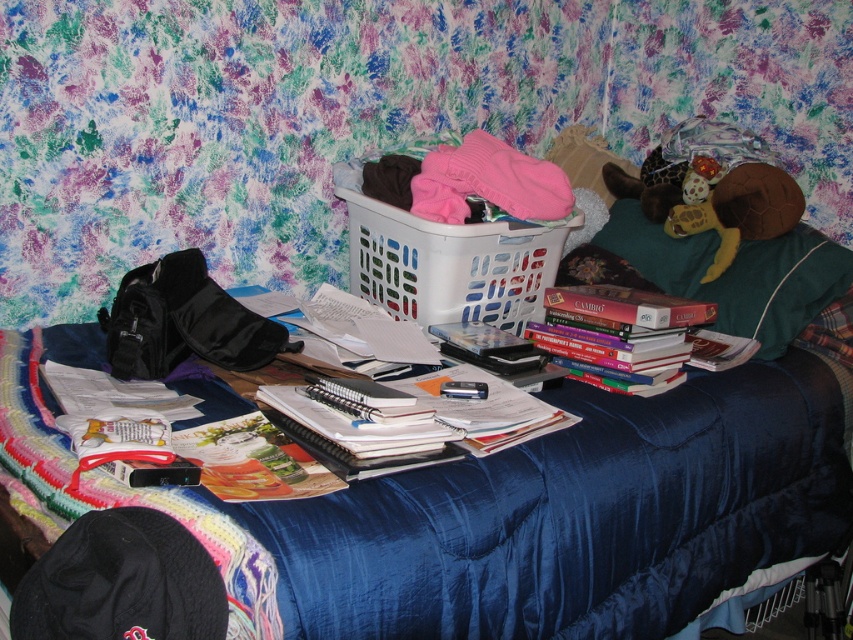
Question: Is the position of white plastic laundry basket at center less distant than that of green fabric pillow at upper right?

Choices:
 (A) yes
 (B) no

Answer: (A)

Question: Considering the real-world distances, which object is closest to the white plastic laundry basket at center?

Choices:
 (A) green fabric pillow at upper right
 (B) hardcover books at center

Answer: (B)

Question: Where is green fabric pillow at upper right located in relation to hardcover books at center in the image?

Choices:
 (A) above
 (B) below

Answer: (A)

Question: Which point appears farthest from the camera in this image?

Choices:
 (A) (480, 276)
 (B) (636, 236)

Answer: (B)

Question: Which is farther from the white plastic laundry basket at center?

Choices:
 (A) hardcover books at center
 (B) green fabric pillow at upper right

Answer: (B)

Question: Is green fabric pillow at upper right above hardcover books at center?

Choices:
 (A) no
 (B) yes

Answer: (B)